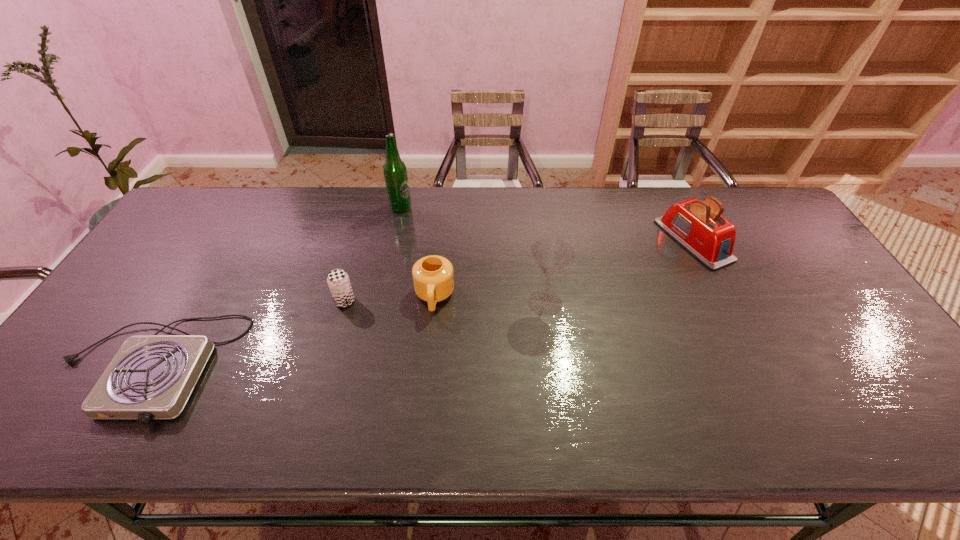
You are a GUI agent. You are given a task and a screenshot of the screen. Output one action in this format:
    pyautogui.click(x=<x>, y=<y>)
    Task: Click on the blank area at the far edge
    The height and width of the screenshot is (540, 960).
    Given the screenshot: What is the action you would take?
    [x=462, y=190]

This screenshot has width=960, height=540. I want to click on free space at the near edge of the desktop, so click(675, 437).

Find the location of a particular element. This screenshot has height=540, width=960. vacant space at the left edge of the desktop is located at coordinates pos(111,361).

I want to click on free space at the right edge, so click(x=857, y=332).

Find the location of a particular element. free space at the near left corner is located at coordinates (68, 438).

In the image, there is a desktop. Where is `free space at the far right corner`? free space at the far right corner is located at coordinates (759, 195).

Identify the location of empty location between the third object from right to left and the fifth object from left to right. The image size is (960, 540). (490, 300).

Locate an element on the screen. empty location between the toaster and the second object from right to left is located at coordinates (619, 272).

Find the location of `vacant area between the tallest object and the fifth shortest object`. vacant area between the tallest object and the fifth shortest object is located at coordinates point(473,255).

Identify the location of free space between the fourth shortest object and the second object from left to right. This screenshot has height=540, width=960. (519, 271).